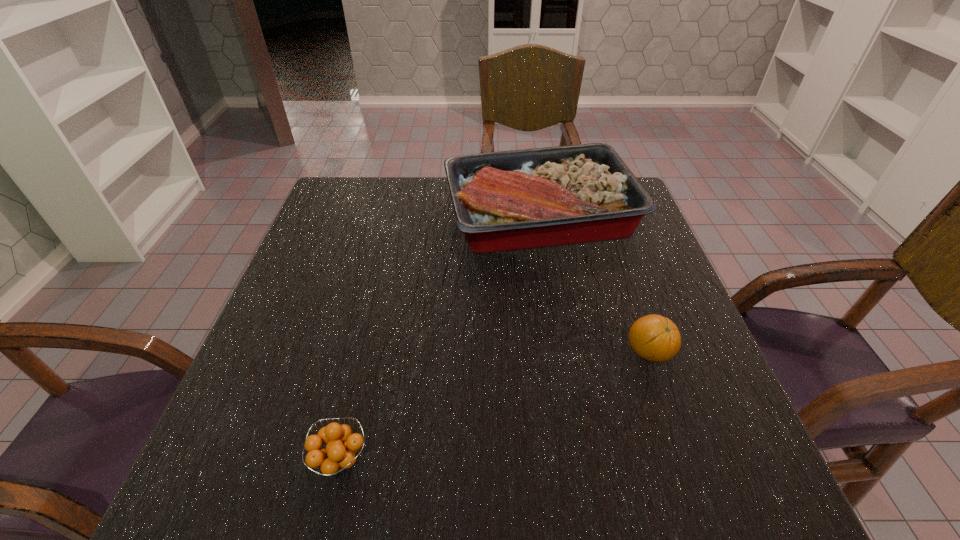
Where is `free point between the tallest object and the nearer orange fruit`? The width and height of the screenshot is (960, 540). free point between the tallest object and the nearer orange fruit is located at coordinates 440,338.

The width and height of the screenshot is (960, 540). In order to click on empty location between the right orange fruit and the shortest object in this screenshot , I will do `click(494, 406)`.

I want to click on unoccupied area between the farther orange fruit and the tallest object, so click(594, 285).

This screenshot has width=960, height=540. I want to click on free space between the nearer orange fruit and the second farthest object, so click(x=494, y=406).

You are a GUI agent. You are given a task and a screenshot of the screen. Output one action in this format:
    pyautogui.click(x=<x>, y=<y>)
    Task: Click on the free spot between the shortest object and the tallest object
    The width and height of the screenshot is (960, 540).
    Given the screenshot: What is the action you would take?
    pyautogui.click(x=440, y=338)

This screenshot has width=960, height=540. In order to click on free space between the tray and the farther orange fruit in this screenshot , I will do `click(594, 285)`.

The image size is (960, 540). In order to click on free space between the nearer orange fruit and the second tallest object in this screenshot , I will do `click(494, 406)`.

I want to click on empty space that is in between the shorter orange fruit and the tallest object, so click(x=440, y=338).

The height and width of the screenshot is (540, 960). I want to click on vacant point located between the farthest object and the nearest object, so click(440, 338).

Choose which object is the second nearest neighbor to the tallest object. Please provide its 2D coordinates. Your answer should be formatted as a tuple, i.e. [(x, y)], where the tuple contains the x and y coordinates of a point satisfying the conditions above.

[(336, 456)]